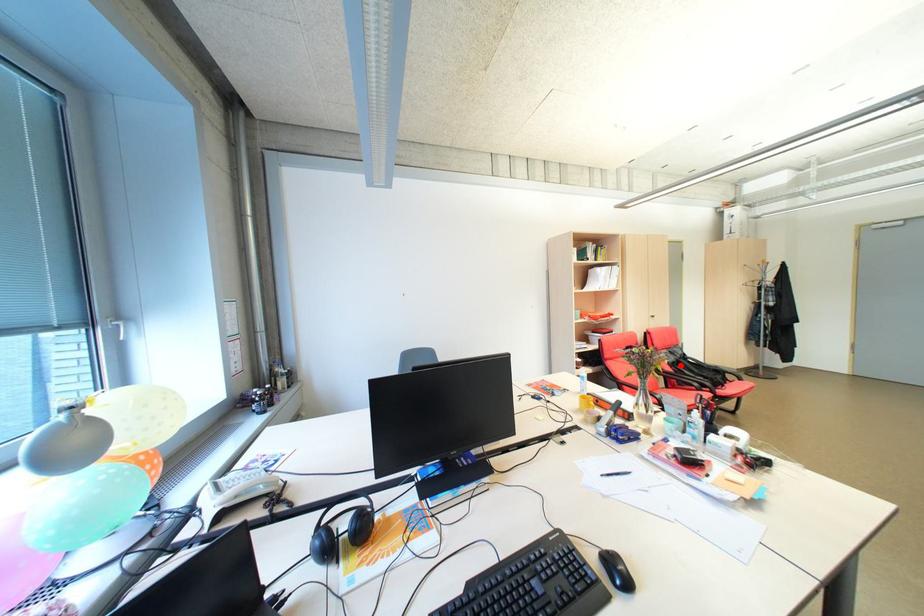
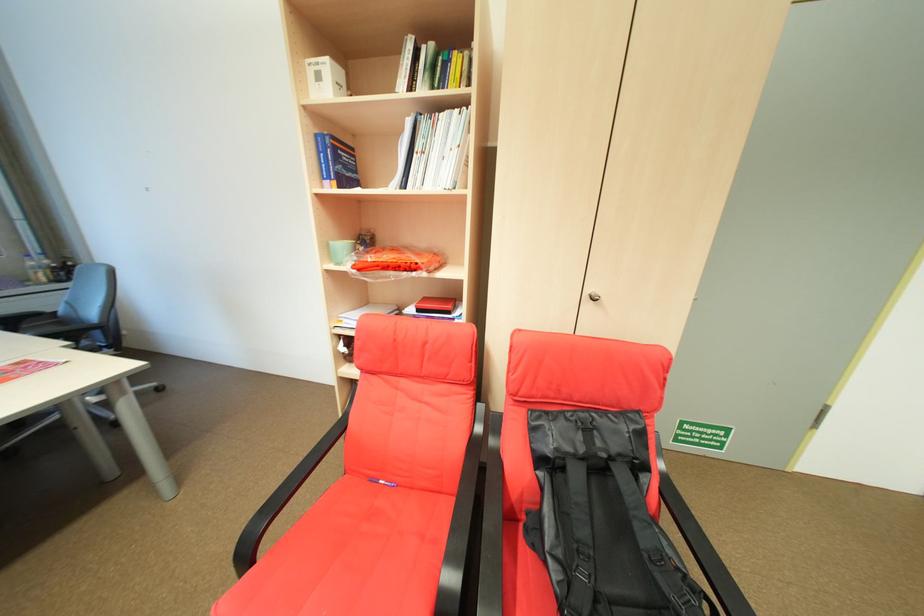
Question: I am providing you with two images of the same scene from different viewpoints. A red point is shown in image1. For the corresponding object point in image2, is it positioned nearer or farther from the camera?

Choices:
 (A) Nearer
 (B) Farther

Answer: (A)